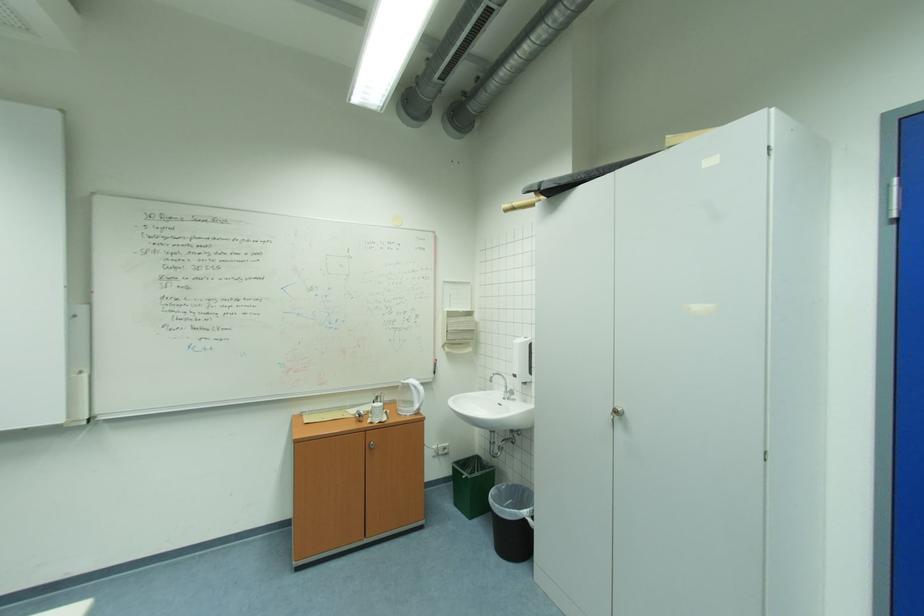
What do you see at coordinates (578, 177) in the screenshot?
I see `the black umbrella` at bounding box center [578, 177].